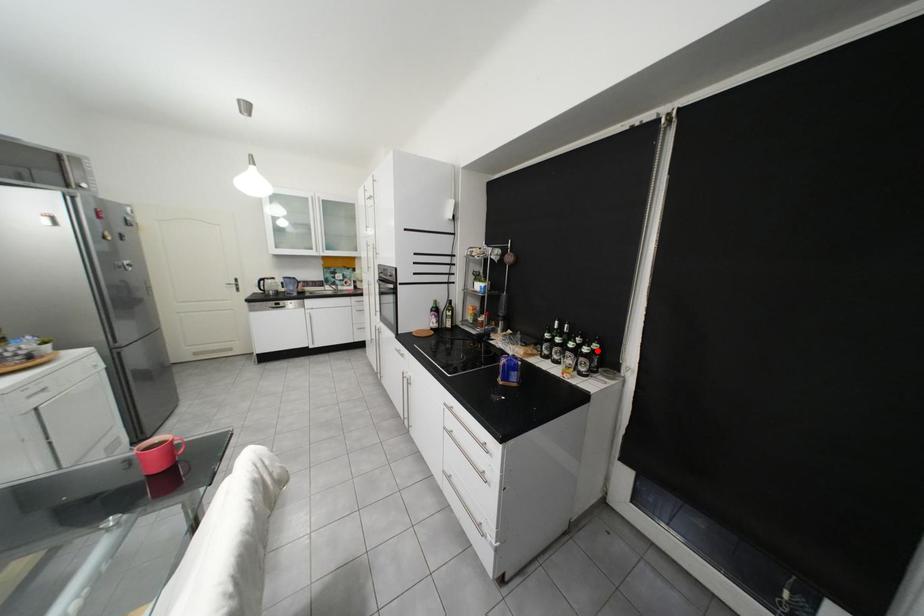
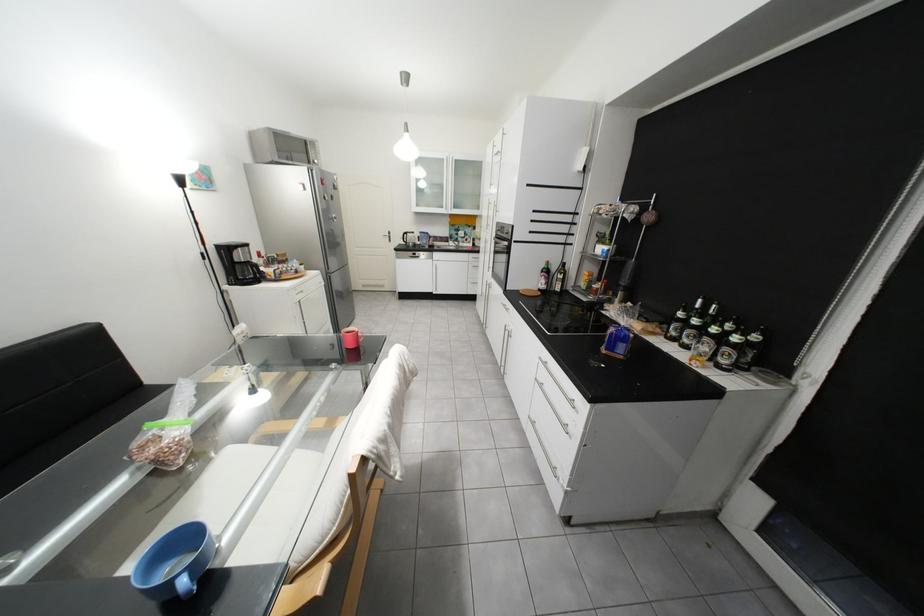
Where in the second image is the point corresponding to the highlighted location from the first image?

(747, 339)